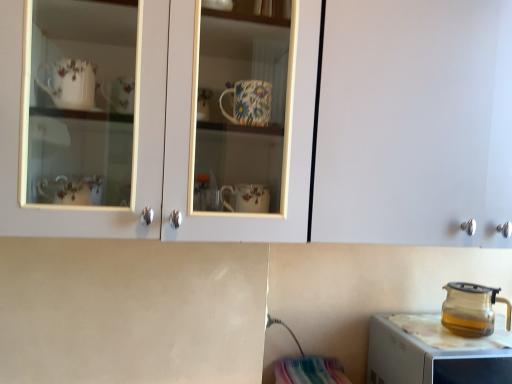
Question: Is transparent glass kettle at lower right bigger than transparent glass teapot at right?

Choices:
 (A) yes
 (B) no

Answer: (A)

Question: Can you confirm if transparent glass kettle at lower right is shorter than transparent glass teapot at right?

Choices:
 (A) yes
 (B) no

Answer: (B)

Question: Is transparent glass kettle at lower right thinner than transparent glass teapot at right?

Choices:
 (A) no
 (B) yes

Answer: (A)

Question: Is transparent glass kettle at lower right touching transparent glass teapot at right?

Choices:
 (A) yes
 (B) no

Answer: (B)

Question: Can you confirm if transparent glass kettle at lower right is wider than transparent glass teapot at right?

Choices:
 (A) yes
 (B) no

Answer: (A)

Question: Is transparent glass teapot at right at the back of transparent glass kettle at lower right?

Choices:
 (A) no
 (B) yes

Answer: (A)

Question: Is transparent glass kettle at lower right to the right of matte white cabinet at upper center from the viewer's perspective?

Choices:
 (A) no
 (B) yes

Answer: (B)

Question: Can you confirm if transparent glass kettle at lower right is wider than matte white cabinet at upper center?

Choices:
 (A) yes
 (B) no

Answer: (A)

Question: Does transparent glass kettle at lower right turn towards matte white cabinet at upper center?

Choices:
 (A) yes
 (B) no

Answer: (B)

Question: Is transparent glass kettle at lower right thinner than matte white cabinet at upper center?

Choices:
 (A) yes
 (B) no

Answer: (B)

Question: Is transparent glass kettle at lower right further to camera compared to matte white cabinet at upper center?

Choices:
 (A) yes
 (B) no

Answer: (A)

Question: Considering the relative sizes of transparent glass kettle at lower right and matte white cabinet at upper center in the image provided, is transparent glass kettle at lower right taller than matte white cabinet at upper center?

Choices:
 (A) no
 (B) yes

Answer: (A)

Question: Is transparent glass teapot at right far away from transparent glass kettle at lower right?

Choices:
 (A) no
 (B) yes

Answer: (A)